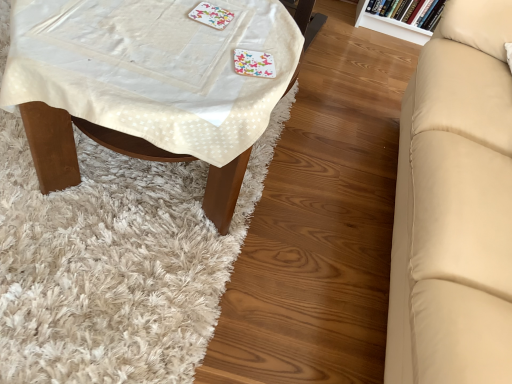
Locate an element on the screen. Image resolution: width=512 pixels, height=384 pixels. vacant space to the left of colorful paper coaster at upper center is located at coordinates (156, 10).